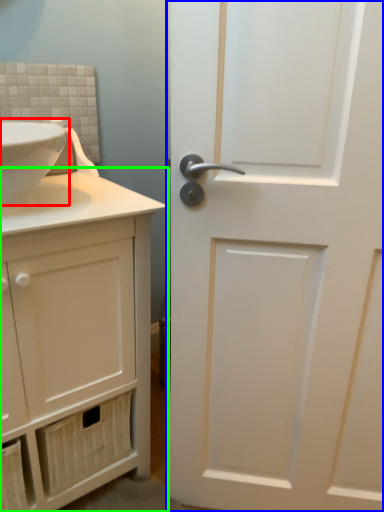
Question: Which is farther away from sink (highlighted by a red box)? door (highlighted by a blue box) or bathroom cabinet (highlighted by a green box)?

Choices:
 (A) door
 (B) bathroom cabinet

Answer: (A)